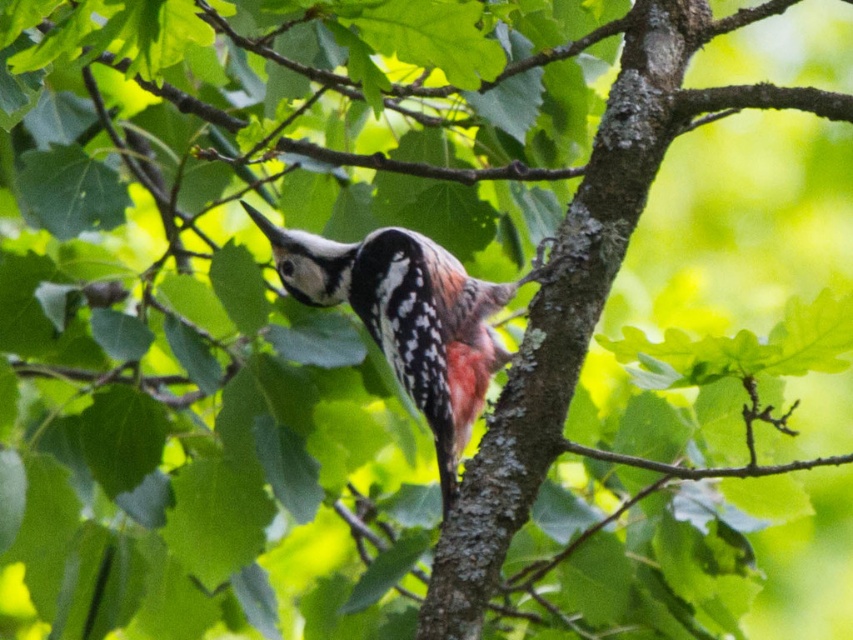
You are a birdwatcher trying to locate the smooth bark tree trunk at center in the image. According to the coordinates provided, where would you look to find it?

The smooth bark tree trunk at center is located at coordinates point (563, 314).

A woodpecker is perched on a tree branch. A point is located at coordinates point (515, 419). If the woodpecker moves straight towards this point, will it land on the branch?

The woodpecker is currently on the branch, and the point (515, 419) is 8.45 feet away from it. Since the branch is sturdy and the distance is manageable, the woodpecker can move towards the point and land there if it chooses to.